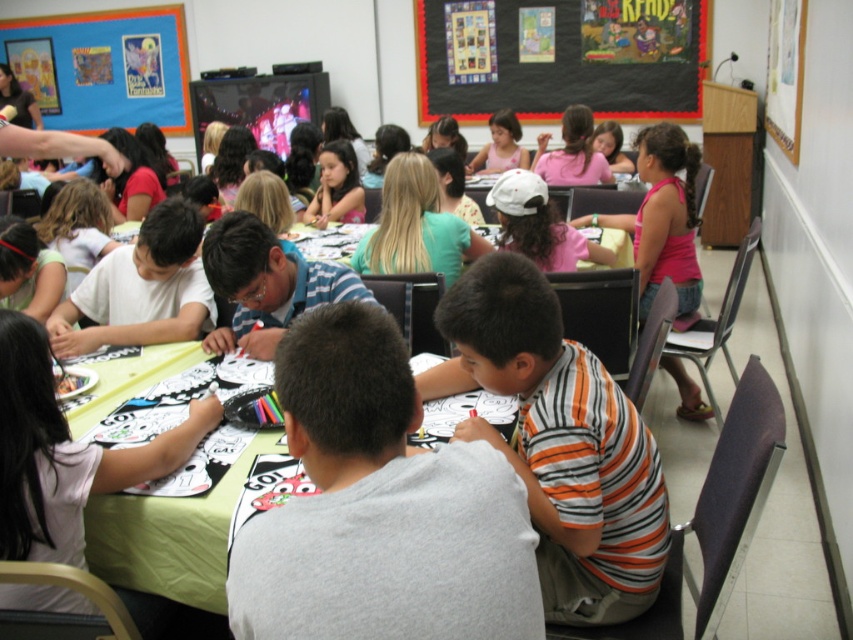
How much distance is there between orange striped shirt at center and white paper at center?

The distance of orange striped shirt at center from white paper at center is 73.75 centimeters.

Is point (630, 557) farther from camera compared to point (78, 600)?

Yes, point (630, 557) is behind point (78, 600).

Describe the element at coordinates (560, 442) in the screenshot. I see `orange striped shirt at center` at that location.

Identify the location of orange striped shirt at center. The image size is (853, 640). (560, 442).

Is black matte bulletin board at upper center taller than white paper at center?

Correct, black matte bulletin board at upper center is much taller as white paper at center.

Can you confirm if black matte bulletin board at upper center is positioned to the left of white paper at center?

In fact, black matte bulletin board at upper center is to the right of white paper at center.

Locate an element on the screen. The image size is (853, 640). black matte bulletin board at upper center is located at coordinates (560, 58).

Is orange striped shirt at center thinner than pink fabric shirt at center?

Yes.

Who is positioned more to the left, orange striped shirt at center or pink fabric shirt at center?

orange striped shirt at center

I want to click on orange striped shirt at center, so click(x=560, y=442).

Find the location of a particular element. Image resolution: width=853 pixels, height=640 pixels. orange striped shirt at center is located at coordinates (560, 442).